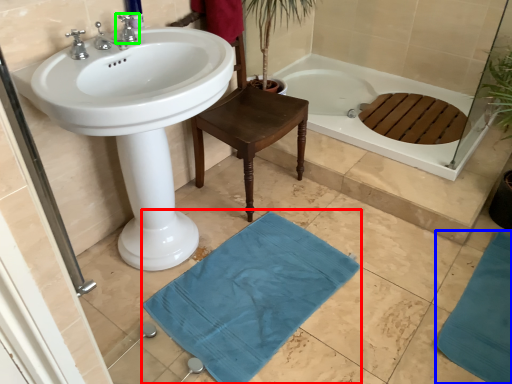
Question: Based on their relative distances, which object is nearer to bath mat (highlighted by a red box)? Choose from bath mat (highlighted by a blue box) and tap (highlighted by a green box).

Choices:
 (A) bath mat
 (B) tap

Answer: (A)